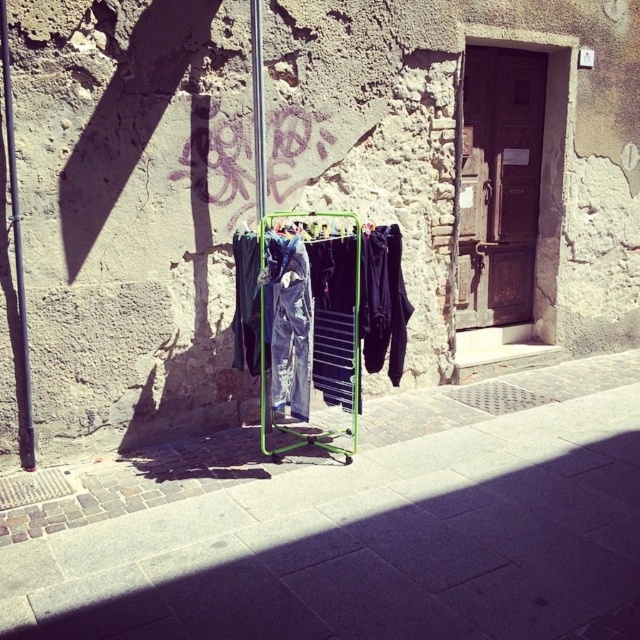
Can you confirm if denim pants at center is positioned below denim jeans at center?

No, denim pants at center is not below denim jeans at center.

Between point (317, 387) and point (305, 353), which one is positioned behind?

The point (317, 387) is behind.

Who is more distant from viewer, (x=332, y=342) or (x=300, y=268)?

Point (x=332, y=342)

Find the location of a particular element. denim pants at center is located at coordinates tap(332, 316).

Does smooth concrete pavement at center appear on the right side of denim jeans at center?

Yes, smooth concrete pavement at center is to the right of denim jeans at center.

What do you see at coordinates (365, 544) in the screenshot? The height and width of the screenshot is (640, 640). I see `smooth concrete pavement at center` at bounding box center [365, 544].

The image size is (640, 640). Describe the element at coordinates (365, 544) in the screenshot. I see `smooth concrete pavement at center` at that location.

The height and width of the screenshot is (640, 640). Identify the location of smooth concrete pavement at center. (365, 544).

Does smooth concrete pavement at center appear under denim pants at center?

Indeed, smooth concrete pavement at center is positioned under denim pants at center.

Is smooth concrete pavement at center smaller than denim pants at center?

Actually, smooth concrete pavement at center might be larger than denim pants at center.

Who is more distant from viewer, (307, 580) or (282, 259)?

The point (282, 259) is behind.

This screenshot has width=640, height=640. What are the coordinates of `smooth concrete pavement at center` in the screenshot? It's located at pos(365,544).